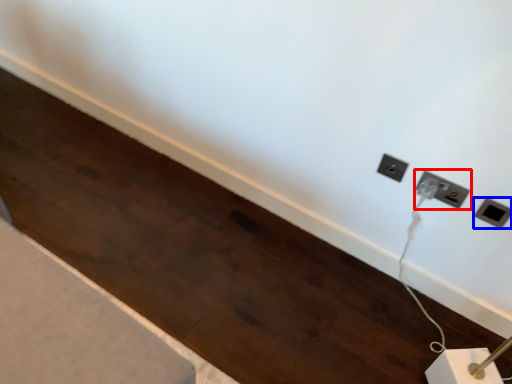
Question: Which point is further to the camera, power plugs and sockets (highlighted by a red box) or power plugs and sockets (highlighted by a blue box)?

Choices:
 (A) power plugs and sockets
 (B) power plugs and sockets

Answer: (A)